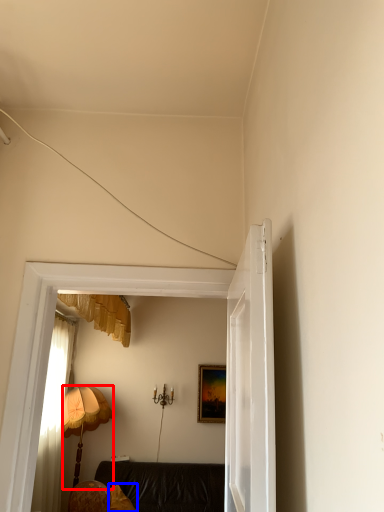
Question: Among these objects, which one is nearest to the camera, lamp (highlighted by a red box) or pillow (highlighted by a blue box)?

Choices:
 (A) lamp
 (B) pillow

Answer: (B)